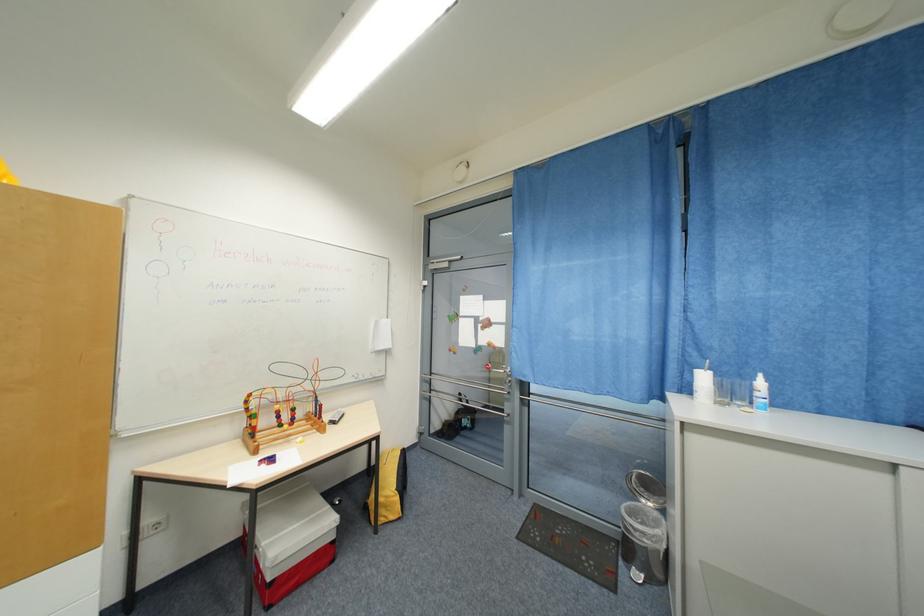
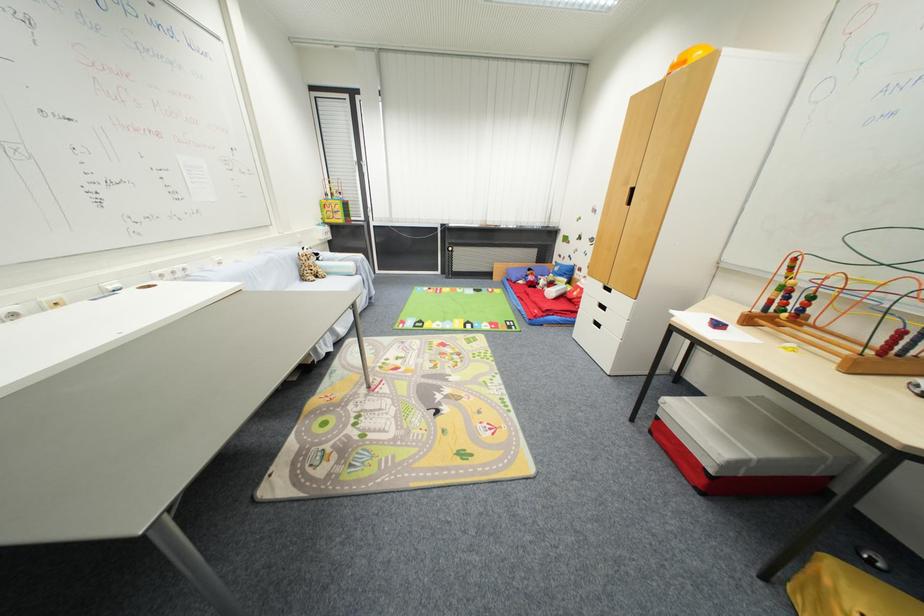
Where in the second image is the point corresponding to point (286, 427) from the first image?

(789, 313)